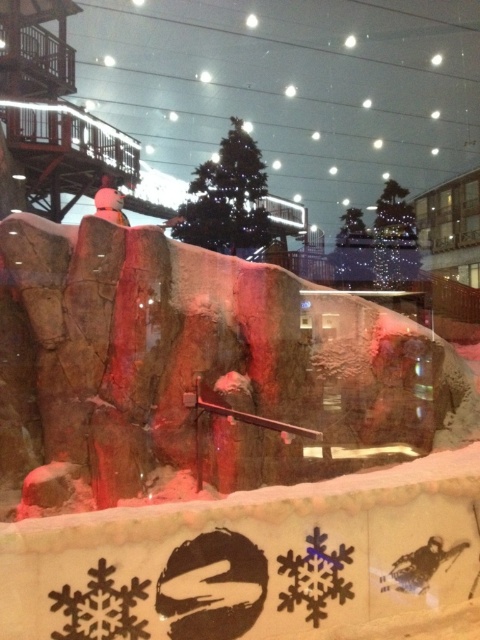
Does green matte christmas tree at center appear over black paper snowflake at lower center?

Yes, green matte christmas tree at center is above black paper snowflake at lower center.

Does green matte christmas tree at center come in front of black paper snowflake at lower center?

No, it is behind black paper snowflake at lower center.

Who is more forward, (263, 164) or (336, 579)?

Positioned in front is point (336, 579).

At what (x,y) coordinates should I click in order to perform the action: click on green matte christmas tree at center. Please return your answer as a coordinate pair (x, y). The height and width of the screenshot is (640, 480). Looking at the image, I should click on (228, 196).

Which is behind, point (235, 179) or point (143, 209)?

The point (143, 209) is more distant.

I want to click on green matte christmas tree at center, so click(228, 196).

Is black paper snowflake at lower center below white matte snowboarder at center?

Correct, black paper snowflake at lower center is located below white matte snowboarder at center.

Between point (280, 573) and point (120, 205), which one is positioned in front?

Point (280, 573) is more forward.

Where is `black paper snowflake at lower center`? Image resolution: width=480 pixels, height=640 pixels. black paper snowflake at lower center is located at coordinates (314, 577).